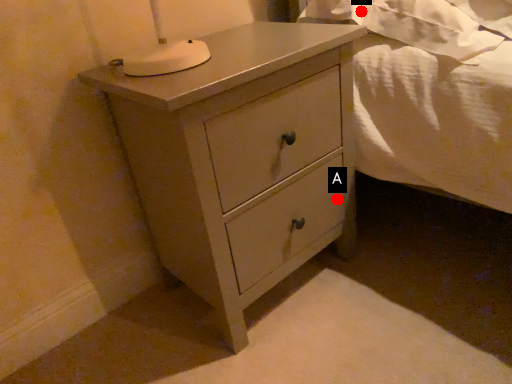
Question: Two points are circled on the image, labeled by A and B beside each circle. Which point is closer to the camera?

Choices:
 (A) A is closer
 (B) B is closer

Answer: (B)